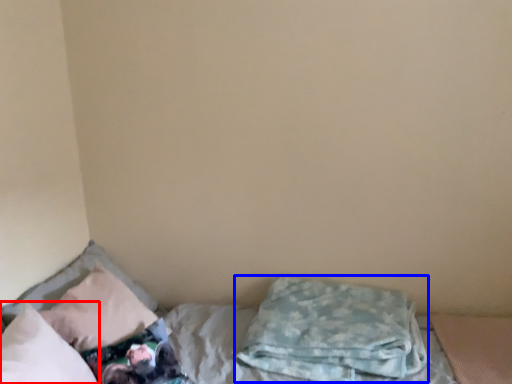
Question: Among these objects, which one is nearest to the camera, pillow (highlighted by a red box) or pillow (highlighted by a blue box)?

Choices:
 (A) pillow
 (B) pillow

Answer: (A)